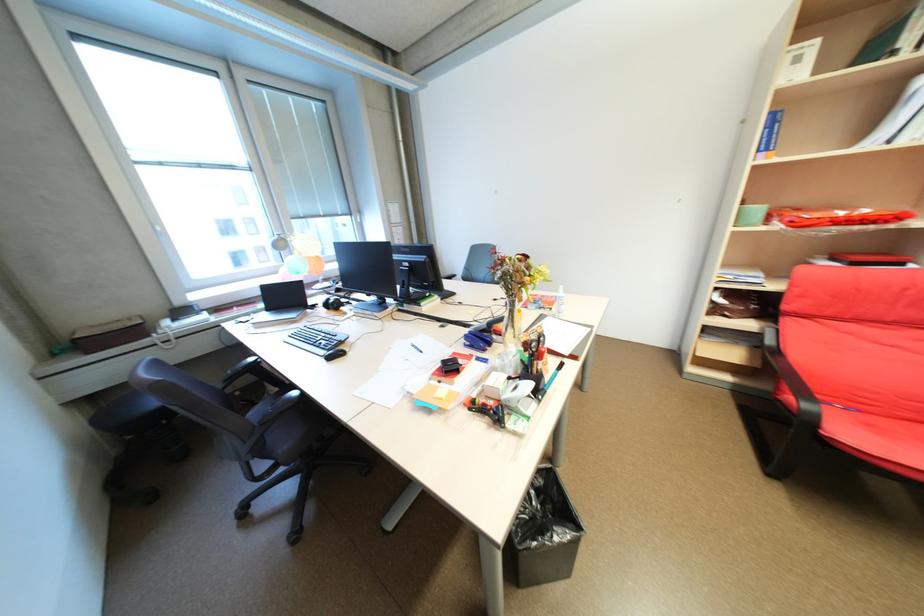
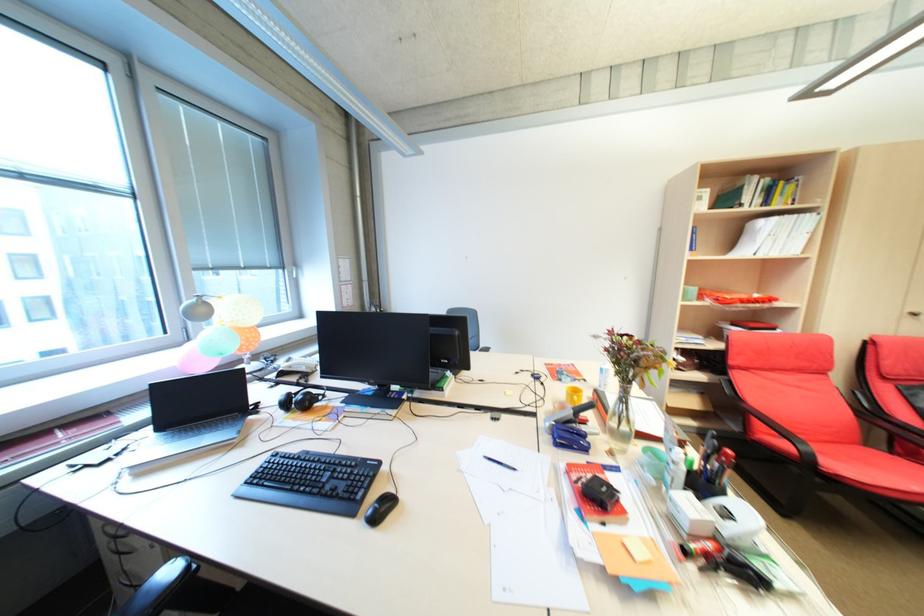
Find the pixel in the second image that matches [878,426] in the first image.

(831, 454)